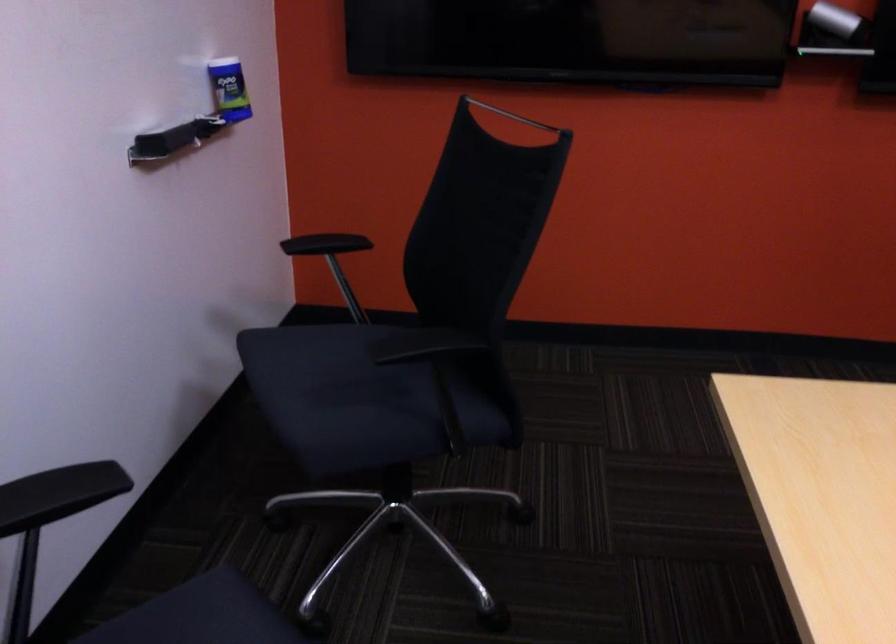
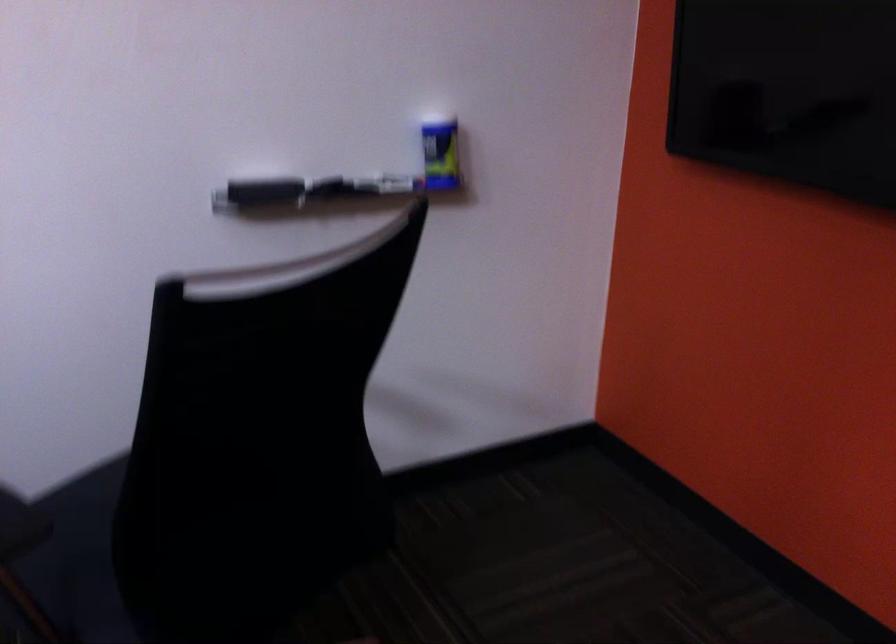
In the second image, find the point that corresponds to (183,142) in the first image.

(261, 191)